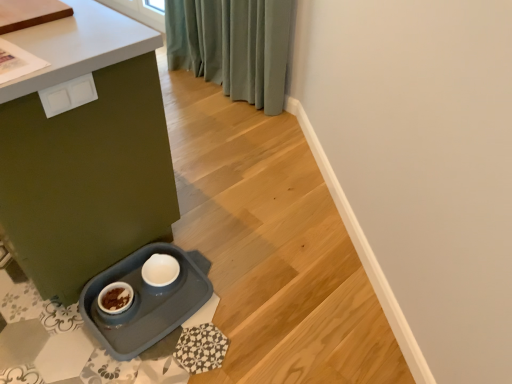
Where is `matte gray tray at lower left`? This screenshot has width=512, height=384. matte gray tray at lower left is located at coordinates (85, 152).

The height and width of the screenshot is (384, 512). Describe the element at coordinates (85, 152) in the screenshot. I see `matte gray tray at lower left` at that location.

In order to click on white plastic drawer at upper left in this screenshot , I will do [68, 95].

This screenshot has width=512, height=384. Describe the element at coordinates (68, 95) in the screenshot. I see `white plastic drawer at upper left` at that location.

At what (x,y) coordinates should I click in order to perform the action: click on matte gray tray at lower left. Please return your answer as a coordinate pair (x, y). Looking at the image, I should click on (85, 152).

Which object is positioned more to the right, matte gray tray at lower left or white plastic drawer at upper left?

Positioned to the right is white plastic drawer at upper left.

Which object is further away from the camera, matte gray tray at lower left or white plastic drawer at upper left?

white plastic drawer at upper left is more distant.

Does point (15, 103) come farther from viewer compared to point (49, 105)?

No.

From the image's perspective, which is above, matte gray tray at lower left or white plastic drawer at upper left?

matte gray tray at lower left appears higher in the image.

From a real-world perspective, is matte gray tray at lower left positioned above or below white plastic drawer at upper left?

From a real-world perspective, matte gray tray at lower left is physically below white plastic drawer at upper left.

Considering the sizes of objects matte gray tray at lower left and white plastic drawer at upper left in the image provided, who is thinner, matte gray tray at lower left or white plastic drawer at upper left?

Thinner between the two is white plastic drawer at upper left.

Considering the sizes of objects matte gray tray at lower left and white plastic drawer at upper left in the image provided, who is taller, matte gray tray at lower left or white plastic drawer at upper left?

matte gray tray at lower left.

Who is bigger, matte gray tray at lower left or white plastic drawer at upper left?

Bigger between the two is matte gray tray at lower left.

Is matte gray tray at lower left not within white plastic drawer at upper left?

That's correct, matte gray tray at lower left is outside of white plastic drawer at upper left.

Is matte gray tray at lower left next to white plastic drawer at upper left and touching it?

matte gray tray at lower left and white plastic drawer at upper left are clearly separated.

Is matte gray tray at lower left facing towards white plastic drawer at upper left?

No, matte gray tray at lower left does not turn towards white plastic drawer at upper left.

How far apart are matte gray tray at lower left and white plastic drawer at upper left?

The distance of matte gray tray at lower left from white plastic drawer at upper left is 11.93 inches.

Where is `table below the white plastic drawer at upper left (from a real-world perspective)`? The image size is (512, 384). table below the white plastic drawer at upper left (from a real-world perspective) is located at coordinates (85, 152).

Based on their positions, is white plastic drawer at upper left located to the left or right of matte gray tray at lower left?

white plastic drawer at upper left is positioned on matte gray tray at lower left's right side.

Is the depth of white plastic drawer at upper left less than that of matte gray tray at lower left?

That is False.

Which is nearer, (52,101) or (176,199)?

Point (52,101).

From the image's perspective, is white plastic drawer at upper left positioned above or below matte gray tray at lower left?

Based on their image positions, white plastic drawer at upper left is located beneath matte gray tray at lower left.

From a real-world perspective, who is located lower, white plastic drawer at upper left or matte gray tray at lower left?

matte gray tray at lower left.

Considering the sizes of objects white plastic drawer at upper left and matte gray tray at lower left in the image provided, who is wider, white plastic drawer at upper left or matte gray tray at lower left?

With larger width is matte gray tray at lower left.

In the scene shown: Between white plastic drawer at upper left and matte gray tray at lower left, which one has more height?

matte gray tray at lower left.

Can you confirm if white plastic drawer at upper left is bigger than matte gray tray at lower left?

No.

Can we say white plastic drawer at upper left lies outside matte gray tray at lower left?

No, white plastic drawer at upper left is not entirely external to matte gray tray at lower left.

Does white plastic drawer at upper left touch matte gray tray at lower left?

white plastic drawer at upper left is not next to matte gray tray at lower left, and they're not touching.

Is white plastic drawer at upper left turned away from matte gray tray at lower left?

That's right, white plastic drawer at upper left is facing away from matte gray tray at lower left.

Measure the distance from white plastic drawer at upper left to matte gray tray at lower left.

white plastic drawer at upper left and matte gray tray at lower left are 30.29 centimeters apart from each other.

Where is `table on the left side of white plastic drawer at upper left`? The width and height of the screenshot is (512, 384). table on the left side of white plastic drawer at upper left is located at coordinates (85, 152).

The width and height of the screenshot is (512, 384). In order to click on table that appears in front of the white plastic drawer at upper left in this screenshot , I will do `click(85, 152)`.

Where is `drawer behind the matte gray tray at lower left`? The width and height of the screenshot is (512, 384). drawer behind the matte gray tray at lower left is located at coordinates (68, 95).